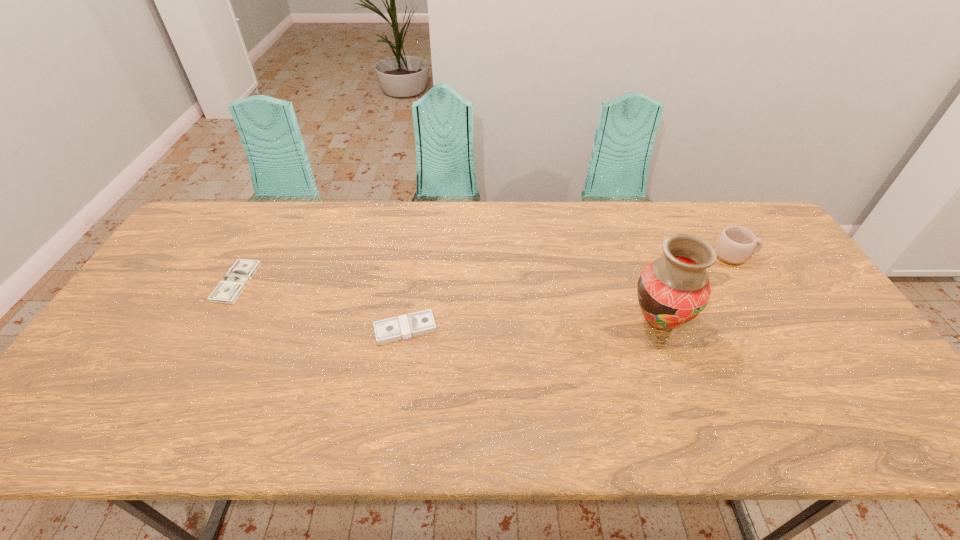
Locate an element on the screen. The height and width of the screenshot is (540, 960). vacant space situated 0.150m on the front of the shorter dollar is located at coordinates (200, 348).

Find the location of a particular element. object present at the far edge is located at coordinates (734, 245).

The height and width of the screenshot is (540, 960). I want to click on object located in the right edge section of the desktop, so click(734, 245).

The image size is (960, 540). I want to click on object that is at the far right corner, so click(x=734, y=245).

Where is `vacant region at the far edge of the desktop`? vacant region at the far edge of the desktop is located at coordinates (329, 239).

Identify the location of vacant space at the near edge. (671, 414).

This screenshot has height=540, width=960. Find the location of `vacant space at the left edge`. vacant space at the left edge is located at coordinates (114, 396).

Identify the location of blank space at the right edge. 823,363.

Locate an element on the screen. free space at the far left corner of the desktop is located at coordinates (221, 242).

Find the location of a particular element. The image size is (960, 540). blank region between the second object from left to right and the third object from left to right is located at coordinates (532, 325).